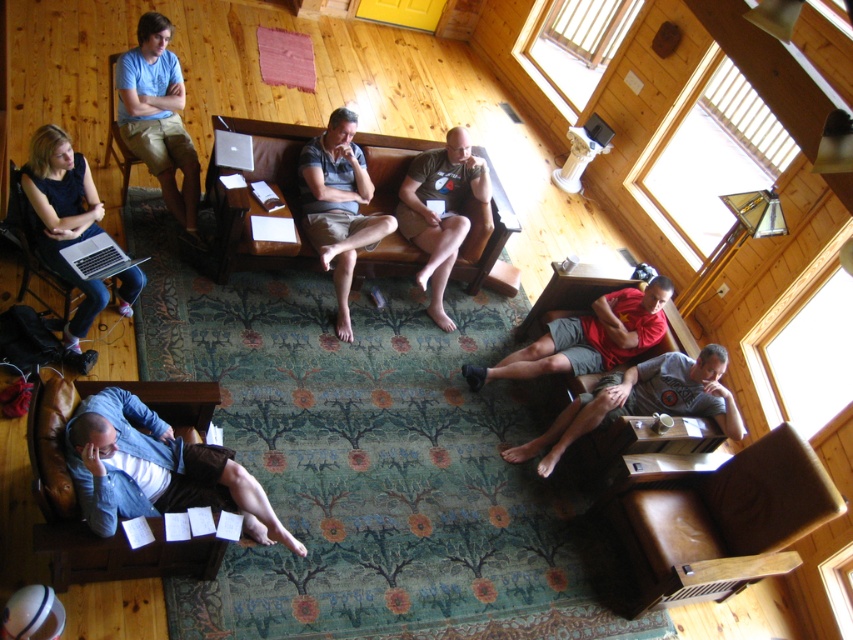
Question: Which object is closer to the camera taking this photo?

Choices:
 (A) dark blue fabric armchair at lower left
 (B) brown leather couch at center
 (C) red cotton t-shirt at lower right
 (D) matte blue shirt at upper left

Answer: (A)

Question: Which object is the farthest from the dark gray t-shirt at center?

Choices:
 (A) denim jacket at lower left
 (B) silver metallic laptop at upper center
 (C) light blue t-shirt at upper left

Answer: (A)

Question: Which object is farther from the camera taking this photo?

Choices:
 (A) brown leather armchair at lower left
 (B) light blue t-shirt at upper left

Answer: (B)

Question: Observing the image, what is the correct spatial positioning of matte khaki shorts at center in reference to dark blue fabric armchair at lower left?

Choices:
 (A) below
 (B) above

Answer: (B)

Question: From the image, what is the correct spatial relationship of matte black laptop at left in relation to matte blue shirt at upper left?

Choices:
 (A) above
 (B) below

Answer: (B)

Question: Can you confirm if denim jacket at lower left is positioned below silver metallic laptop at upper center?

Choices:
 (A) no
 (B) yes

Answer: (B)